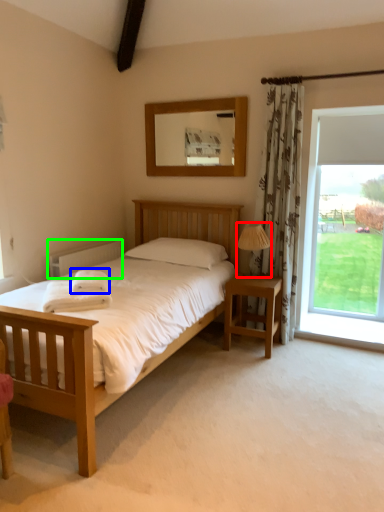
Question: Which object is the farthest from lamp (highlighted by a red box)? Choose among these: cloth (highlighted by a blue box) or radiator (highlighted by a green box).

Choices:
 (A) cloth
 (B) radiator

Answer: (B)